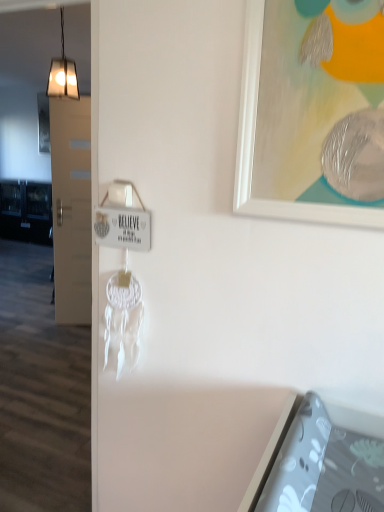
Question: Does white matte picture frame at upper right have a greater width compared to metallic square light fixture at upper left?

Choices:
 (A) yes
 (B) no

Answer: (B)

Question: Is white matte picture frame at upper right oriented away from metallic square light fixture at upper left?

Choices:
 (A) yes
 (B) no

Answer: (B)

Question: Could you tell me if white matte picture frame at upper right is facing metallic square light fixture at upper left?

Choices:
 (A) no
 (B) yes

Answer: (A)

Question: Does white matte picture frame at upper right have a greater height compared to metallic square light fixture at upper left?

Choices:
 (A) no
 (B) yes

Answer: (A)

Question: Is white matte picture frame at upper right shorter than metallic square light fixture at upper left?

Choices:
 (A) no
 (B) yes

Answer: (B)

Question: From a real-world perspective, does white matte picture frame at upper right sit lower than metallic square light fixture at upper left?

Choices:
 (A) yes
 (B) no

Answer: (A)

Question: Considering the relative sizes of metallic square light fixture at upper left and white matte picture frame at upper right in the image provided, is metallic square light fixture at upper left thinner than white matte picture frame at upper right?

Choices:
 (A) no
 (B) yes

Answer: (A)

Question: Is metallic square light fixture at upper left oriented towards white matte picture frame at upper right?

Choices:
 (A) yes
 (B) no

Answer: (B)

Question: Does metallic square light fixture at upper left have a greater width compared to white matte picture frame at upper right?

Choices:
 (A) no
 (B) yes

Answer: (B)

Question: Is the position of metallic square light fixture at upper left less distant than that of white matte picture frame at upper right?

Choices:
 (A) yes
 (B) no

Answer: (B)

Question: Is metallic square light fixture at upper left turned away from white matte picture frame at upper right?

Choices:
 (A) no
 (B) yes

Answer: (A)

Question: Is metallic square light fixture at upper left in contact with white matte picture frame at upper right?

Choices:
 (A) yes
 (B) no

Answer: (B)

Question: From the image's perspective, is metallic square light fixture at upper left above or below white matte picture frame at upper right?

Choices:
 (A) above
 (B) below

Answer: (A)